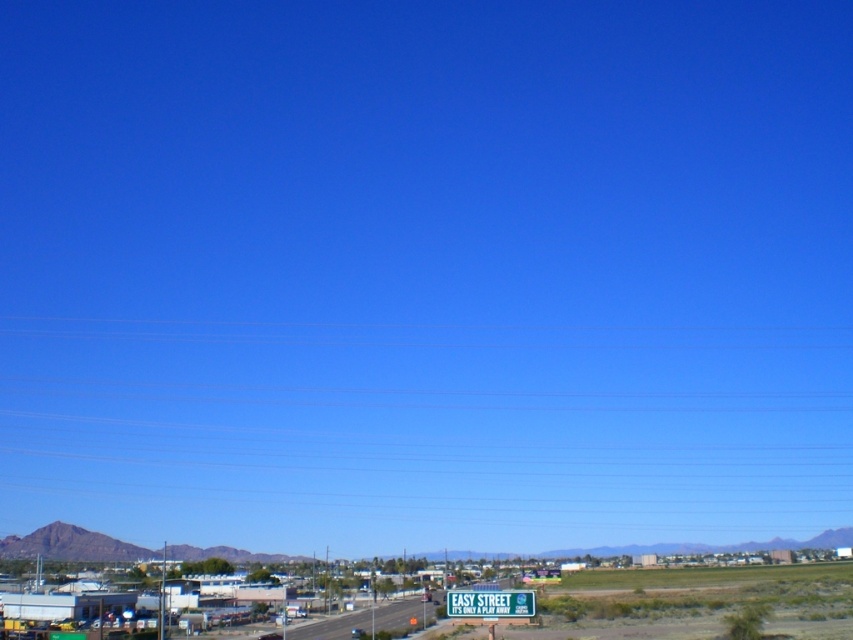
Does smooth asphalt highway at center have a smaller size compared to green plastic sign at lower center?

Actually, smooth asphalt highway at center might be larger than green plastic sign at lower center.

Who is lower down, smooth asphalt highway at center or green plastic sign at lower center?

smooth asphalt highway at center

Between point (409, 611) and point (496, 604), which one is positioned in front?

Point (496, 604) is in front.

Locate an element on the screen. smooth asphalt highway at center is located at coordinates (360, 620).